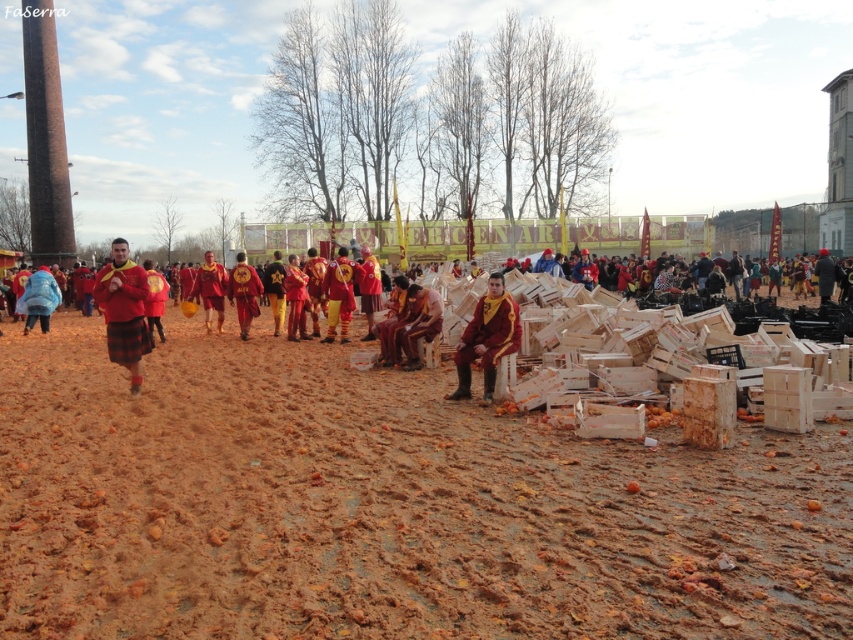
You are a participant in this event and need to decide where to place your equipment. If you have an item that requires a taller space, which object between the matte red kilt at left and the shiny red fabric at center would be more suitable for placement?

The matte red kilt at left is much taller than the shiny red fabric at center, so it would be more suitable for placing items that require a taller space.

You are standing at the center of the festival scene and want to take a photo. There are two points marked in the image, point 1 at coordinates point (x=125, y=280) and point 2 at coordinates point (x=374, y=269). Which point should you focus on to ensure it appears larger in your photo?

Point 1 at coordinates point (x=125, y=280) is closer to the camera than point 2 at coordinates point (x=374, y=269), so focusing on point 1 will make it appear larger in the photo.

You are a photographer at the event and want to capture both the blue fabric jacket at left and the matte red shirt at center in a single frame. Which object should you position closer to the left side of your camera viewfinder to ensure both are included?

To include both the blue fabric jacket at left and the matte red shirt at center in the frame, position the blue fabric jacket at left closer to the left side of your camera viewfinder since it is already to the left of the matte red shirt at center.